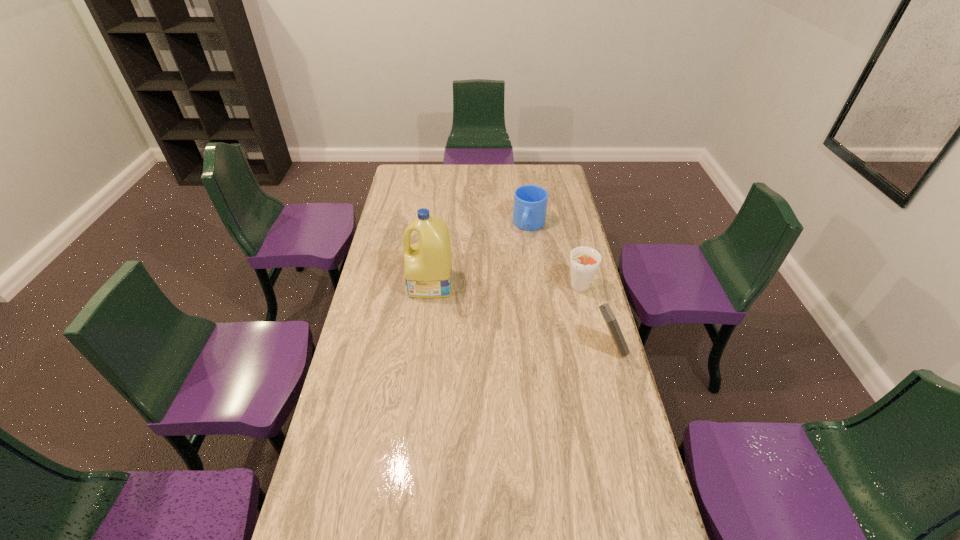
Locate an element on the screen. unoccupied area between the nearest object and the mug is located at coordinates (569, 286).

Where is `free space between the nearest object and the root beer`? The image size is (960, 540). free space between the nearest object and the root beer is located at coordinates (594, 318).

Locate an element on the screen. The height and width of the screenshot is (540, 960). object that ranks as the third closest to the shortest object is located at coordinates (610, 319).

You are a GUI agent. You are given a task and a screenshot of the screen. Output one action in this format:
    pyautogui.click(x=<x>, y=<y>)
    Task: Click on the closest object to the root beer
    The image size is (960, 540).
    Given the screenshot: What is the action you would take?
    pyautogui.click(x=610, y=319)